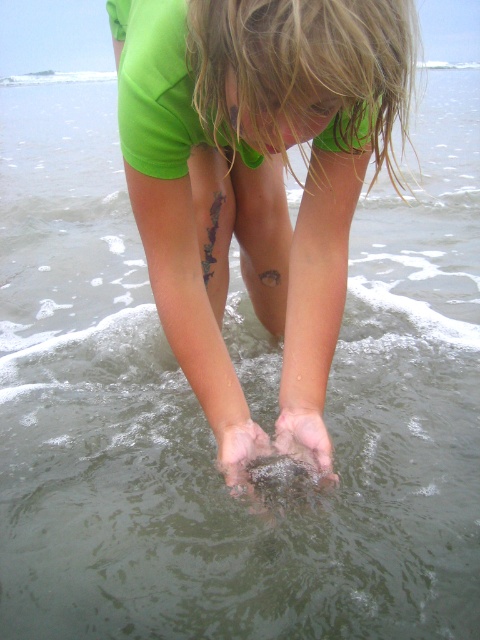
Between green matte shorts at center and smooth skin hand at lower center, which one is positioned higher?

green matte shorts at center is above.

Find the location of a particular element. green matte shorts at center is located at coordinates (254, 166).

Where is `green matte shorts at center`? Image resolution: width=480 pixels, height=640 pixels. green matte shorts at center is located at coordinates (254, 166).

Is green matte shorts at center above dry sand at feet lower?

Correct, green matte shorts at center is located above dry sand at feet lower.

Measure the distance between green matte shorts at center and dry sand at feet lower.

A distance of 18.80 inches exists between green matte shorts at center and dry sand at feet lower.

Find the location of a particular element. green matte shorts at center is located at coordinates (254, 166).

This screenshot has width=480, height=640. Describe the element at coordinates (304, 440) in the screenshot. I see `smooth skin hand at lower center` at that location.

Who is lower down, smooth skin hand at lower center or dry sand at feet lower?

Positioned lower is dry sand at feet lower.

Which is behind, point (289, 451) or point (251, 432)?

Positioned behind is point (251, 432).

Identify the location of smooth skin hand at lower center. The height and width of the screenshot is (640, 480). (304, 440).